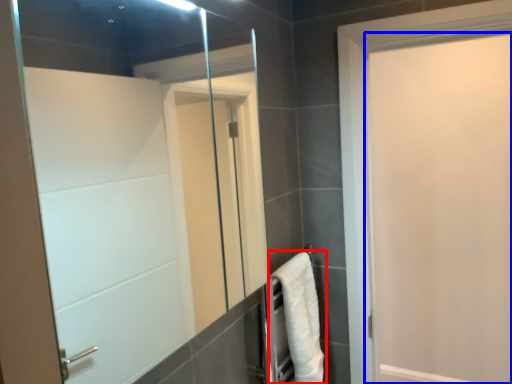
Question: Which of the following is the closest to the observer, bath towel (highlighted by a red box) or door (highlighted by a blue box)?

Choices:
 (A) bath towel
 (B) door

Answer: (B)